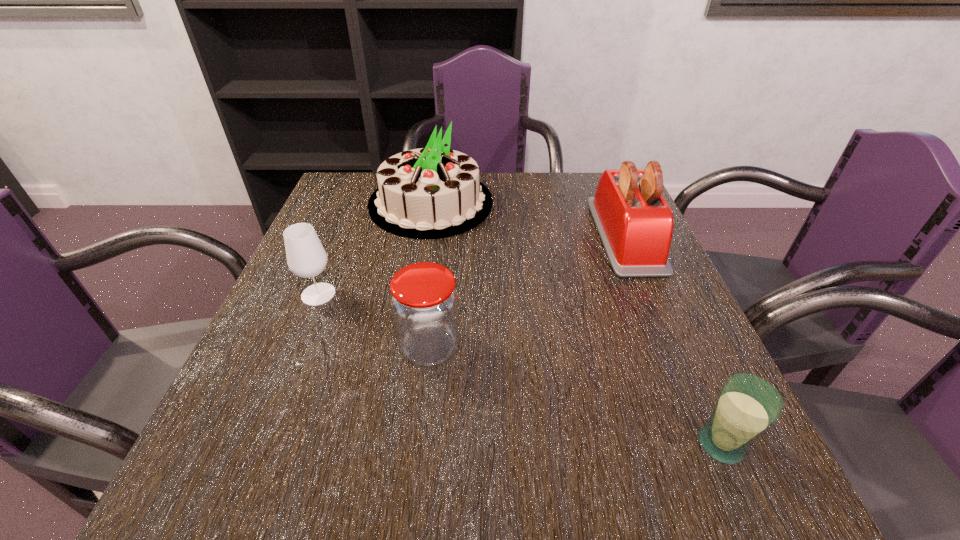
Image resolution: width=960 pixels, height=540 pixels. I want to click on vacant space that satisfies the following two spatial constraints: 1. on the back side of the third farthest object; 2. on the right side of the toaster, so click(342, 235).